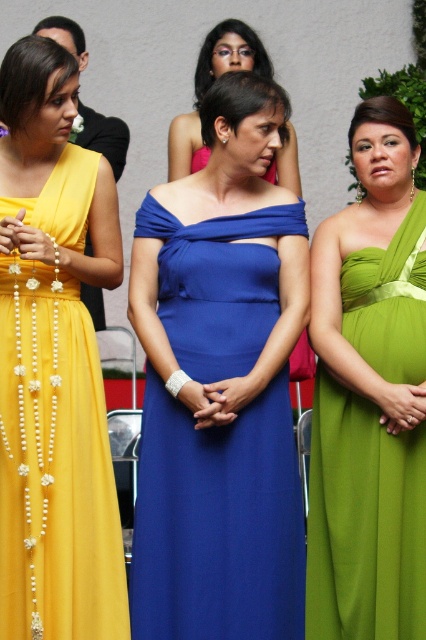
You are a photographer at a formal event. You need to arrange the matte blue dress at center and the green satin dress at right so that both fit within a 1.5 meter wide frame. Given their sizes, is this possible?

The matte blue dress at center occupies less space than the green satin dress at right. Since the total width required would be the sum of both dresses, and the frame is 1.5 meters wide, it depends on their individual widths. However, without specific measurements, we cannot confirm if they fit together. Please provide more details.

You are a photographer at the event and want to capture a photo where both the green satin dress at right and the blue satin dress at center are visible. Based on their positions, which dress is positioned lower in the frame?

The green satin dress at right is positioned lower in the frame than the blue satin dress at center.

You are a photographer at an indoor event. You need to capture a photo of the yellow satin dress at left and green satin dress at right. Based on their positions, which dress will appear larger in the photo?

The yellow satin dress at left appears larger in the photo because it is positioned over the green satin dress at right, indicating it is closer to the camera.